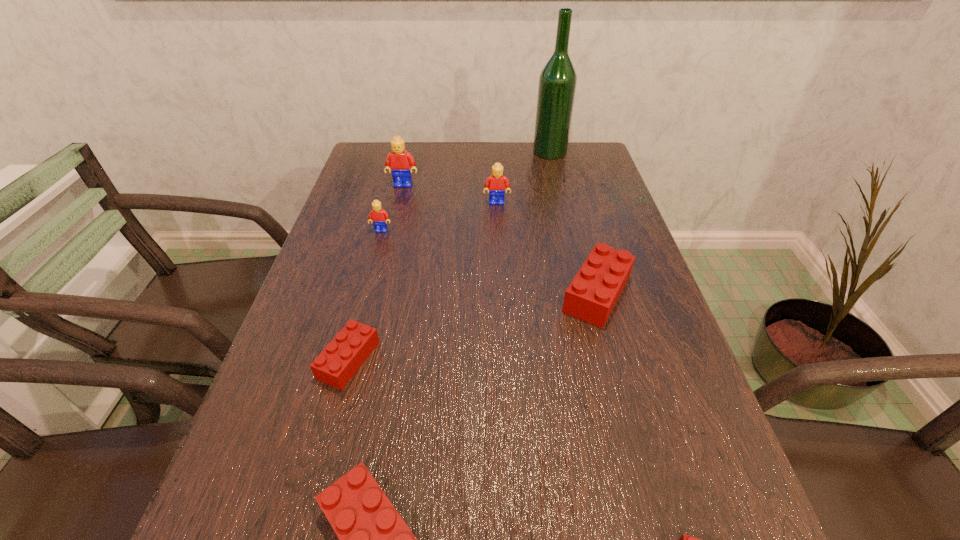
This screenshot has height=540, width=960. I want to click on blank region between the fifth nearest object and the second biggest yellow Lego, so click(439, 217).

Locate an element on the screen. free space between the tallest object and the third nearest red Lego is located at coordinates (449, 256).

Locate an element on the screen. object that ranks as the sixth closest to the fifth object from left to right is located at coordinates (373, 538).

Find the location of a particular element. This screenshot has height=540, width=960. the third closest object relative to the farthest object is located at coordinates (591, 296).

Locate an element on the screen. Lego that can be found as the fifth closest to the sixth tallest Lego is located at coordinates (685, 539).

The height and width of the screenshot is (540, 960). I want to click on Lego identified as the closest to the sixth farthest object, so [x=373, y=538].

Locate an element on the screen. This screenshot has height=540, width=960. yellow Lego that is the second closest to the biggest red Lego is located at coordinates pyautogui.click(x=379, y=217).

Select which yellow Lego appears as the second closest to the nearest yellow Lego. Please provide its 2D coordinates. Your answer should be formatted as a tuple, i.e. [(x, y)], where the tuple contains the x and y coordinates of a point satisfying the conditions above.

[(496, 183)]

Select which red Lego is the third closest to the fourth nearest object. Please provide its 2D coordinates. Your answer should be formatted as a tuple, i.e. [(x, y)], where the tuple contains the x and y coordinates of a point satisfying the conditions above.

[(685, 539)]

The image size is (960, 540). I want to click on red Lego object that ranks as the third closest to the green alcohol, so click(373, 538).